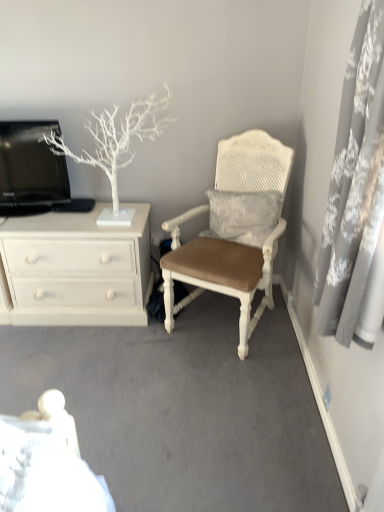
The width and height of the screenshot is (384, 512). I want to click on free space in front of white painted wood chest of drawers at left, so click(85, 371).